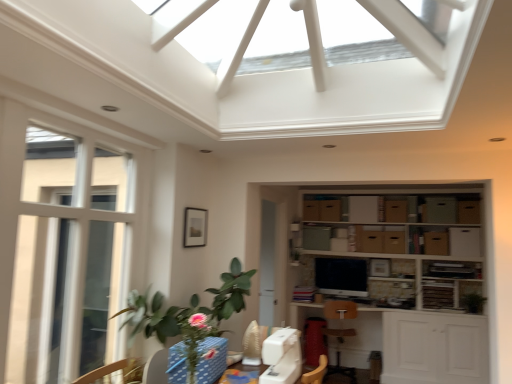
Locate an element on the screen. The height and width of the screenshot is (384, 512). brown cardboard cabinet at center-right, arranged as the first cabinetry when ordered from the bottom is located at coordinates (436, 243).

Describe the element at coordinates (65, 244) in the screenshot. Image resolution: width=512 pixels, height=384 pixels. I see `clear glass window at left` at that location.

Image resolution: width=512 pixels, height=384 pixels. What do you see at coordinates (396, 210) in the screenshot?
I see `brown cardboard cabinet at upper center, which appears as the first cabinetry when viewed from the left` at bounding box center [396, 210].

The image size is (512, 384). Describe the element at coordinates (316, 86) in the screenshot. I see `white glossy exhaust hood at upper center` at that location.

Locate an element on the screen. white glossy exhaust hood at upper center is located at coordinates (316, 86).

Locate an element on the screen. This screenshot has height=384, width=512. brown cardboard cabinet at center-right, the 1th cabinetry when ordered from right to left is located at coordinates (436, 243).

Considering the relative positions of green leafy plant at lower left and wooden shelves at center in the image provided, is green leafy plant at lower left to the left or to the right of wooden shelves at center?

green leafy plant at lower left is positioned on wooden shelves at center's left side.

From the image's perspective, which one is positioned lower, green leafy plant at lower left or wooden shelves at center?

green leafy plant at lower left is shown below in the image.

From a real-world perspective, is green leafy plant at lower left physically above wooden shelves at center?

No, from a real-world perspective, green leafy plant at lower left is not on top of wooden shelves at center.

Which of these two, green leafy plant at lower left or wooden shelves at center, stands shorter?

green leafy plant at lower left is shorter.

From the image's perspective, relative to wooden armchair at center, is green leafy plant at lower left above or below?

Based on their image positions, green leafy plant at lower left is located above wooden armchair at center.

Based on their positions, is green leafy plant at lower left located to the left or right of wooden armchair at center?

In the image, green leafy plant at lower left appears on the left side of wooden armchair at center.

From a real-world perspective, is green leafy plant at lower left on top of wooden armchair at center?

Yes, from a real-world perspective, green leafy plant at lower left is over wooden armchair at center

From a real-world perspective, who is located higher, wooden armchair at center or blue polka dot fabric at lower center?

From a 3D spatial view, blue polka dot fabric at lower center is above.

From the image's perspective, which is below, wooden armchair at center or blue polka dot fabric at lower center?

wooden armchair at center.

Considering the sizes of objects wooden armchair at center and blue polka dot fabric at lower center in the image provided, who is taller, wooden armchair at center or blue polka dot fabric at lower center?

wooden armchair at center is taller.

Considering the sizes of objects wooden armchair at center and blue polka dot fabric at lower center in the image provided, who is wider, wooden armchair at center or blue polka dot fabric at lower center?

wooden armchair at center.

Is brown cardboard cabinet at center-right, which ranks as the 2th cabinetry in left-to-right order, bigger or smaller than white glossy exhaust hood at upper center?

Clearly, brown cardboard cabinet at center-right, which ranks as the 2th cabinetry in left-to-right order, is smaller in size than white glossy exhaust hood at upper center.

From a real-world perspective, is brown cardboard cabinet at center-right, the second cabinetry when ordered from top to bottom, positioned over white glossy exhaust hood at upper center based on gravity?

No.

Could you tell me if green leafy plant at lower left is turned towards clear glass window at left?

No, green leafy plant at lower left is not turned towards clear glass window at left.

Consider the image. Is green leafy plant at lower left smaller than clear glass window at left?

No.

Which of these two, green leafy plant at lower left or clear glass window at left, is thinner?

clear glass window at left.

Measure the distance from brown cardboard cabinet at center-right, arranged as the first cabinetry when ordered from the bottom, to green leafy plant at lower left.

brown cardboard cabinet at center-right, arranged as the first cabinetry when ordered from the bottom, is 10.27 feet away from green leafy plant at lower left.

Is green leafy plant at lower left inside brown cardboard cabinet at center-right, arranged as the first cabinetry when ordered from the bottom?

No, green leafy plant at lower left is located outside of brown cardboard cabinet at center-right, arranged as the first cabinetry when ordered from the bottom.

Which is closer, (x=439, y=235) or (x=227, y=297)?

Point (x=439, y=235) appears to be farther away from the viewer than point (x=227, y=297).

Can you confirm if brown cardboard cabinet at center-right, which ranks as the 2th cabinetry in left-to-right order, is bigger than green leafy plant at lower left?

Actually, brown cardboard cabinet at center-right, which ranks as the 2th cabinetry in left-to-right order, might be smaller than green leafy plant at lower left.

Is clear glass window at left directly adjacent to wooden shelves at center?

No.

Is clear glass window at left to the left or to the right of wooden shelves at center in the image?

Clearly, clear glass window at left is on the left of wooden shelves at center in the image.

From the picture: Is clear glass window at left taller than wooden shelves at center?

Yes.

From the image's perspective, which object appears higher, clear glass window at left or wooden shelves at center?

clear glass window at left.

The width and height of the screenshot is (512, 384). Identify the location of shelf that appears behind the green leafy plant at lower left. (396, 247).

Identify the location of armchair that is on the right side of green leafy plant at lower left. (340, 333).

Estimate the real-world distances between objects in this image. Which object is further from white glossy exhaust hood at upper center, green leafy plant at right or brown cardboard cabinet at center-right, which ranks as the 2th cabinetry in left-to-right order?

green leafy plant at right.

When comparing their distances from brown cardboard cabinet at upper center, the 2th cabinetry when ordered from bottom to top, does white plastic swivel chair at center or brown cardboard cabinet at center-right, the second cabinetry when ordered from top to bottom, seem further?

white plastic swivel chair at center lies further to brown cardboard cabinet at upper center, the 2th cabinetry when ordered from bottom to top, than the other object.

From the image, which object appears to be farther from wooden shelves at center, blue polka dot fabric at lower center or wooden armchair at center?

blue polka dot fabric at lower center is positioned further to the anchor wooden shelves at center.

Considering their positions, is green leafy plant at right positioned closer to wooden armchair at center than brown cardboard cabinet at upper center, arranged as the 2th cabinetry when viewed from the right?

brown cardboard cabinet at upper center, arranged as the 2th cabinetry when viewed from the right.

Which object lies nearer to the anchor point blue polka dot fabric at lower center, clear glass window at left or green leafy plant at right?

The object closer to blue polka dot fabric at lower center is clear glass window at left.

Looking at the image, which one is located closer to green leafy plant at right, white glossy exhaust hood at upper center or brown cardboard cabinet at upper center, which appears as the first cabinetry when viewed from the left?

brown cardboard cabinet at upper center, which appears as the first cabinetry when viewed from the left, is positioned closer to the anchor green leafy plant at right.

Based on their spatial positions, is wooden shelves at center or green leafy plant at lower left further from brown cardboard cabinet at upper center, placed as the 1th cabinetry when sorted from top to bottom?

green leafy plant at lower left.

Looking at the image, which one is located further to blue polka dot fabric at lower center, clear glass window at left or wooden shelves at center?

wooden shelves at center.

The image size is (512, 384). In order to click on houseplant positioned between clear glass window at left and brown cardboard cabinet at center-right, arranged as the first cabinetry when ordered from the bottom, from near to far in this screenshot , I will do `click(189, 314)`.

Identify the location of armchair between white plastic swivel chair at center and brown cardboard cabinet at upper center, which appears as the first cabinetry when viewed from the left, in the front-back direction. The height and width of the screenshot is (384, 512). (340, 333).

The image size is (512, 384). What are the coordinates of `shelf between brown cardboard cabinet at upper center, the 2th cabinetry when ordered from bottom to top, and wooden armchair at center, in the vertical direction` in the screenshot? It's located at (396, 247).

Identify the location of drawer between clear glass window at left and wooden shelves at center from front to back. This screenshot has height=384, width=512. (211, 360).